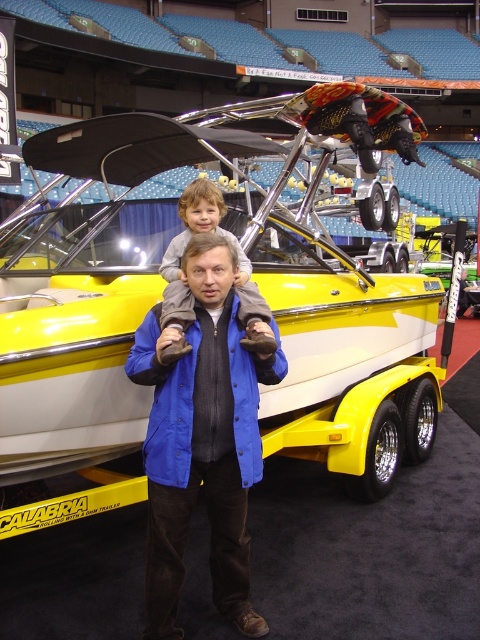
Is point (262, 465) in front of point (194, 218)?

Yes, point (262, 465) is in front of point (194, 218).

Consider the image. Does blue fabric jacket at center have a lesser width compared to light brown plush pants at center?

Incorrect, blue fabric jacket at center's width is not less than light brown plush pants at center's.

Is point (206, 420) more distant than point (181, 314)?

No, it is not.

Locate an element on the screen. The image size is (480, 640). blue fabric jacket at center is located at coordinates (203, 440).